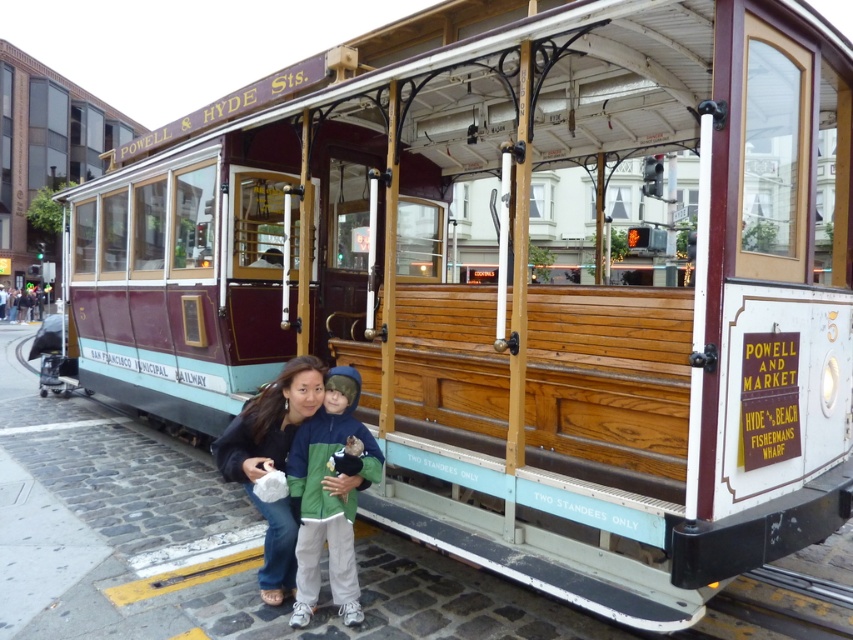
You are standing in front of the cable car and want to take a photo of two points marked in the image. One point is at coordinate point (335, 522) and the other is at point (260, 413). Which point is closer to you?

Point (335, 522) is closer to the viewer than point (260, 413).

You are a photographer trying to capture a clear shot of the green fleece jacket at center and the matte black jacket at lower center. Which jacket should you focus on first to ensure both are in focus?

The green fleece jacket at center is in front of the matte black jacket at lower center. To ensure both are in focus, you should focus on the green fleece jacket at center first, as it is closer to the camera. This will allow the matte black jacket at lower center to remain in focus as well due to the depth of field.

You are a photographer trying to capture both the green fleece jacket at center and the matte black jacket at lower center in a single shot. Based on their heights, which jacket will appear smaller in the photo?

The green fleece jacket at center will appear smaller in the photo because it is not as tall as the matte black jacket at lower center.